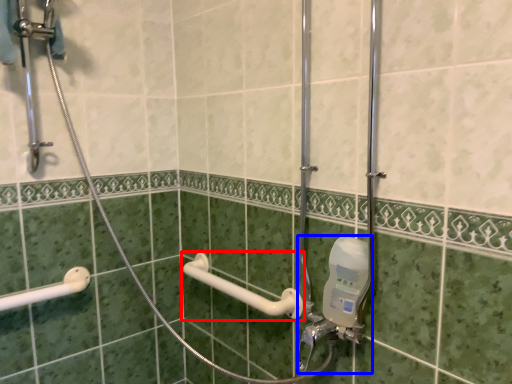
Question: Which of the following is the closest to the observer, towel bar (highlighted by a red box) or plumbing fixture (highlighted by a blue box)?

Choices:
 (A) towel bar
 (B) plumbing fixture

Answer: (B)